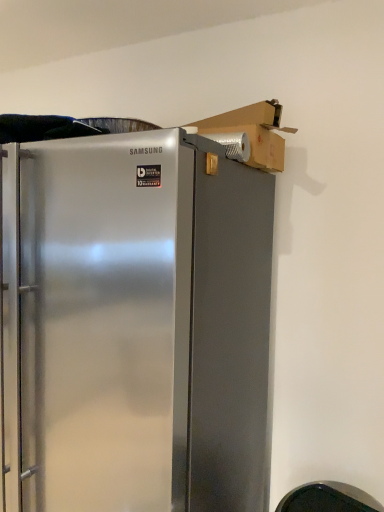
What do you see at coordinates (253, 132) in the screenshot?
I see `cardboard box at upper right` at bounding box center [253, 132].

Measure the distance between point (214, 122) and camera.

Point (214, 122) is 1.34 meters from camera.

You are a GUI agent. You are given a task and a screenshot of the screen. Output one action in this format:
    pyautogui.click(x=<x>, y=<y>)
    Task: Click on the cardboard box at upper right
    This screenshot has height=512, width=384.
    Given the screenshot: What is the action you would take?
    pyautogui.click(x=253, y=132)

Measure the distance between satin metallic refrigerator at center and camera.

satin metallic refrigerator at center is 94.09 centimeters away from camera.

At what (x,y) coordinates should I click in order to perform the action: click on satin metallic refrigerator at center. Please return your answer as a coordinate pair (x, y). Looking at the image, I should click on (135, 326).

Describe the element at coordinates (135, 326) in the screenshot. I see `satin metallic refrigerator at center` at that location.

Image resolution: width=384 pixels, height=512 pixels. In order to click on cardboard box at upper right in this screenshot , I will do `click(253, 132)`.

Considering the positions of objects satin metallic refrigerator at center and cardboard box at upper right in the image provided, who is more to the left, satin metallic refrigerator at center or cardboard box at upper right?

Positioned to the left is satin metallic refrigerator at center.

Looking at this image, is satin metallic refrigerator at center further to the viewer compared to cardboard box at upper right?

No.

Does point (172, 453) appear closer or farther from the camera than point (270, 132)?

Point (172, 453) appears to be closer to the viewer than point (270, 132).

From the image's perspective, is satin metallic refrigerator at center positioned above or below cardboard box at upper right?

Clearly, from the image's perspective, satin metallic refrigerator at center is below cardboard box at upper right.

From a real-world perspective, is satin metallic refrigerator at center located higher than cardboard box at upper right?

No, from a real-world perspective, satin metallic refrigerator at center is not over cardboard box at upper right

Which of these two, satin metallic refrigerator at center or cardboard box at upper right, is wider?

Wider between the two is satin metallic refrigerator at center.

Is satin metallic refrigerator at center taller or shorter than cardboard box at upper right?

Considering their sizes, satin metallic refrigerator at center has more height than cardboard box at upper right.

Considering the relative sizes of satin metallic refrigerator at center and cardboard box at upper right in the image provided, is satin metallic refrigerator at center bigger than cardboard box at upper right?

Yes, satin metallic refrigerator at center is bigger than cardboard box at upper right.

Is satin metallic refrigerator at center positioned beyond the bounds of cardboard box at upper right?

Yes, satin metallic refrigerator at center is outside of cardboard box at upper right.

In the scene shown: Is there a large distance between satin metallic refrigerator at center and cardboard box at upper right?

No, satin metallic refrigerator at center is not far away from cardboard box at upper right.

Is satin metallic refrigerator at center positioned with its back to cardboard box at upper right?

That's not correct — satin metallic refrigerator at center is not looking away from cardboard box at upper right.

Locate an element on the screen. refrigerator located in front of the cardboard box at upper right is located at coordinates (135, 326).

Which is more to the left, cardboard box at upper right or satin metallic refrigerator at center?

From the viewer's perspective, satin metallic refrigerator at center appears more on the left side.

Is cardboard box at upper right positioned in front of satin metallic refrigerator at center?

No, cardboard box at upper right is further to the viewer.

Does point (250, 134) lie behind point (74, 493)?

Yes, it is behind point (74, 493).

From the image's perspective, which is above, cardboard box at upper right or satin metallic refrigerator at center?

cardboard box at upper right appears higher in the image.

From a real-world perspective, who is located lower, cardboard box at upper right or satin metallic refrigerator at center?

satin metallic refrigerator at center is physically lower.

Based on the photo, which object is thinner, cardboard box at upper right or satin metallic refrigerator at center?

cardboard box at upper right.

Is cardboard box at upper right taller than satin metallic refrigerator at center?

No, cardboard box at upper right is not taller than satin metallic refrigerator at center.

Considering the sizes of objects cardboard box at upper right and satin metallic refrigerator at center in the image provided, who is bigger, cardboard box at upper right or satin metallic refrigerator at center?

Answer: Bigger between the two is satin metallic refrigerator at center.

Is cardboard box at upper right spatially inside satin metallic refrigerator at center, or outside of it?

cardboard box at upper right exists outside the volume of satin metallic refrigerator at center.

Is there a large distance between cardboard box at upper right and satin metallic refrigerator at center?

No, cardboard box at upper right is not far from satin metallic refrigerator at center.

Is cardboard box at upper right looking in the opposite direction of satin metallic refrigerator at center?

No, cardboard box at upper right is not facing the opposite direction of satin metallic refrigerator at center.

At what (x,y) coordinates should I click in order to perform the action: click on refrigerator located underneath the cardboard box at upper right (from a real-world perspective). Please return your answer as a coordinate pair (x, y). This screenshot has width=384, height=512. Looking at the image, I should click on (135, 326).

Where is `cardboard box above the satin metallic refrigerator at center (from a real-world perspective)`? This screenshot has width=384, height=512. cardboard box above the satin metallic refrigerator at center (from a real-world perspective) is located at coordinates (253, 132).

At what (x,y) coordinates should I click in order to perform the action: click on refrigerator below the cardboard box at upper right (from the image's perspective). Please return your answer as a coordinate pair (x, y). The width and height of the screenshot is (384, 512). Looking at the image, I should click on (135, 326).